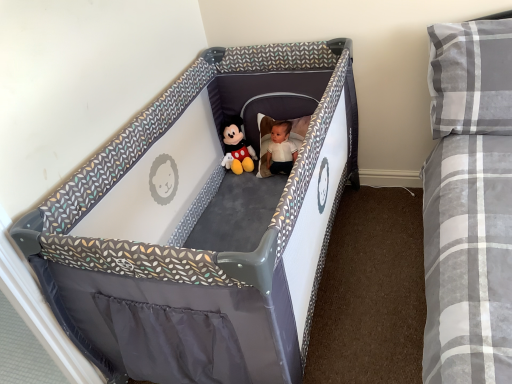
Question: Is soft plush mickey mouse at center facing away from gray plaid pillow at upper right?

Choices:
 (A) yes
 (B) no

Answer: (B)

Question: Considering the relative sizes of soft plush mickey mouse at center and gray plaid pillow at upper right in the image provided, is soft plush mickey mouse at center shorter than gray plaid pillow at upper right?

Choices:
 (A) no
 (B) yes

Answer: (B)

Question: From the image's perspective, does soft plush mickey mouse at center appear higher than gray plaid pillow at upper right?

Choices:
 (A) yes
 (B) no

Answer: (B)

Question: Is soft plush mickey mouse at center located outside gray plaid pillow at upper right?

Choices:
 (A) no
 (B) yes

Answer: (B)

Question: Is the surface of soft plush mickey mouse at center in direct contact with gray plaid pillow at upper right?

Choices:
 (A) yes
 (B) no

Answer: (B)

Question: From a real-world perspective, is gray plaid pillow at upper right positioned above or below soft plush mickey mouse at center?

Choices:
 (A) above
 (B) below

Answer: (A)

Question: Considering their positions, is gray plaid pillow at upper right located in front of or behind soft plush mickey mouse at center?

Choices:
 (A) front
 (B) behind

Answer: (A)

Question: Would you say gray plaid pillow at upper right is inside or outside soft plush mickey mouse at center?

Choices:
 (A) outside
 (B) inside

Answer: (A)

Question: Looking at their shapes, would you say gray plaid pillow at upper right is wider or thinner than soft plush mickey mouse at center?

Choices:
 (A) wide
 (B) thin

Answer: (A)

Question: From a real-world perspective, is soft plush mickey mouse at center physically located above or below gray plaid pillow at upper right?

Choices:
 (A) below
 (B) above

Answer: (A)

Question: Is soft plush mickey mouse at center taller or shorter than gray plaid pillow at upper right?

Choices:
 (A) short
 (B) tall

Answer: (A)

Question: Considering the positions of soft plush mickey mouse at center and gray plaid pillow at upper right in the image, is soft plush mickey mouse at center bigger or smaller than gray plaid pillow at upper right?

Choices:
 (A) small
 (B) big

Answer: (A)

Question: Would you say soft plush mickey mouse at center is inside or outside gray plaid pillow at upper right?

Choices:
 (A) inside
 (B) outside

Answer: (B)

Question: From a real-world perspective, is gray fabric playpen at center above or below soft plush mickey mouse at center?

Choices:
 (A) below
 (B) above

Answer: (A)

Question: From the image's perspective, relative to soft plush mickey mouse at center, is gray fabric playpen at center above or below?

Choices:
 (A) below
 (B) above

Answer: (A)